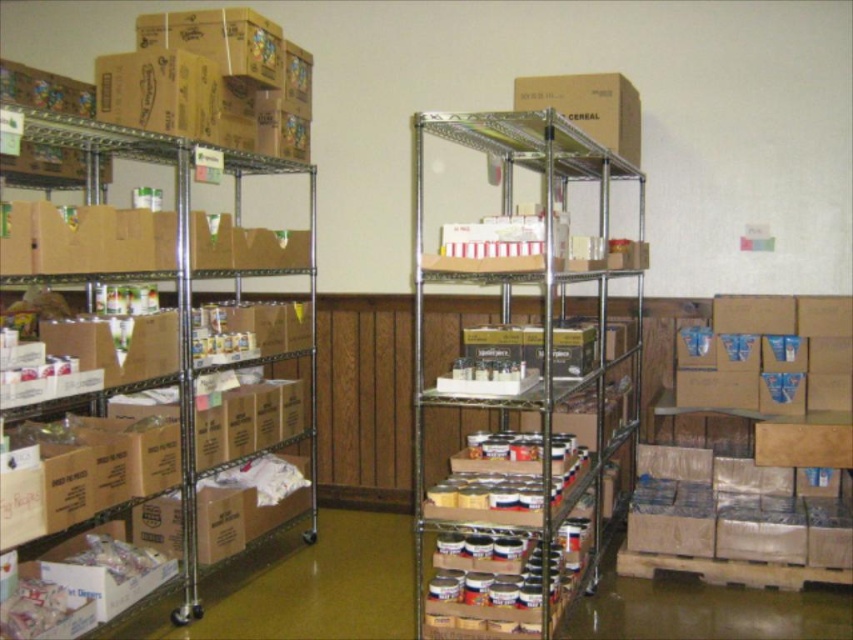
You are standing in the storage area and need to reach a point marked at coordinates (424, 600). If your arm can extend 1.5 meters, can you reach that point without moving closer?

The point at (424, 600) is 2.67 meters away from you. Since your arm can only extend 1.5 meters, you cannot reach it without moving closer.

You need to place a large donation box that is 1.2 meters wide into the storage area. Based on the image, which object, the metallic silver shelves at center or the brown cardboard boxes at left, has enough space to accommodate the donation box?

The brown cardboard boxes at left have a larger size compared to the metallic silver shelves at center, so the donation box can be placed among the brown cardboard boxes at left.

You are a volunteer at the community center and need to retrieve an item from the storage area. You see two points marked in the image. Which point, point (477, 401) or point (149, 141), is closer to you?

Point (477, 401) is closer to you because it is in front of point (149, 141).